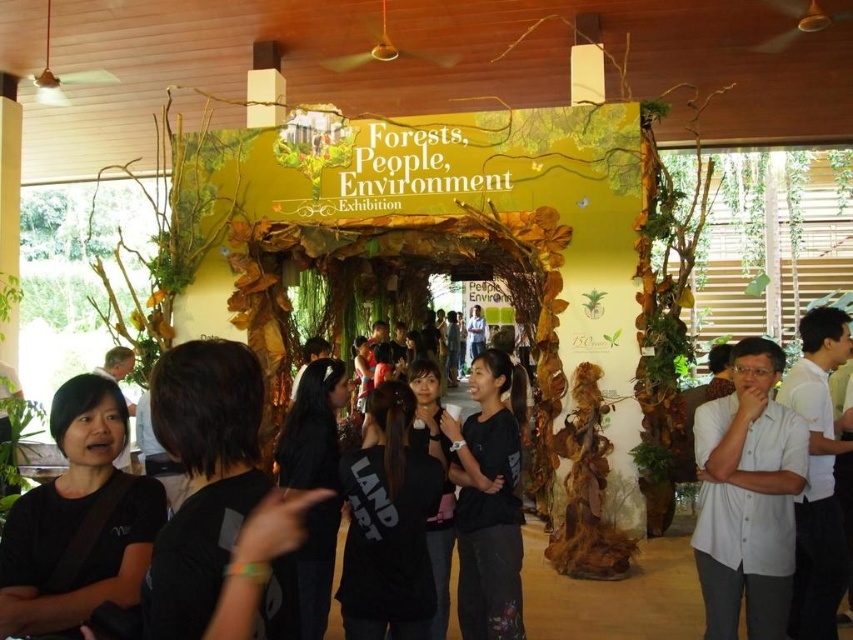
Consider the image. You are organizing a photo shoot in the exhibition hall and need to position two models wearing the black matte shirt at lower left and the white shirt at center. The photographer wants to ensure that the smaller model is placed where they won not overshadow the larger one. Based on their sizes, where should the smaller model be positioned relative to the larger one?

The black matte shirt at lower left is smaller than the white shirt at center. To ensure the smaller model does not overshadow the larger one, the smaller model should be positioned behind the larger one.

You are attending the Forests, People, Environment Exhibition and notice two people in the foreground. The first person is wearing a black matte shirt at lower left, and the other is wearing a white shirt at right. From your perspective as an attendee standing in the center of the room, which person is closer to you?

The black matte shirt at lower left is positioned under the white shirt at right, which means the black matte shirt at lower left is closer to you since it is lower in the image and positioned beneath the other.